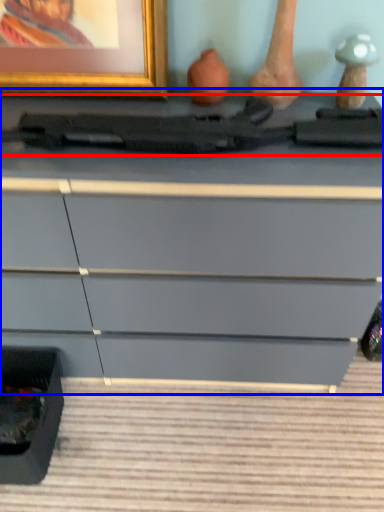
Question: Which object is closer to the camera taking this photo, equipment (highlighted by a red box) or chest of drawers (highlighted by a blue box)?

Choices:
 (A) equipment
 (B) chest of drawers

Answer: (B)